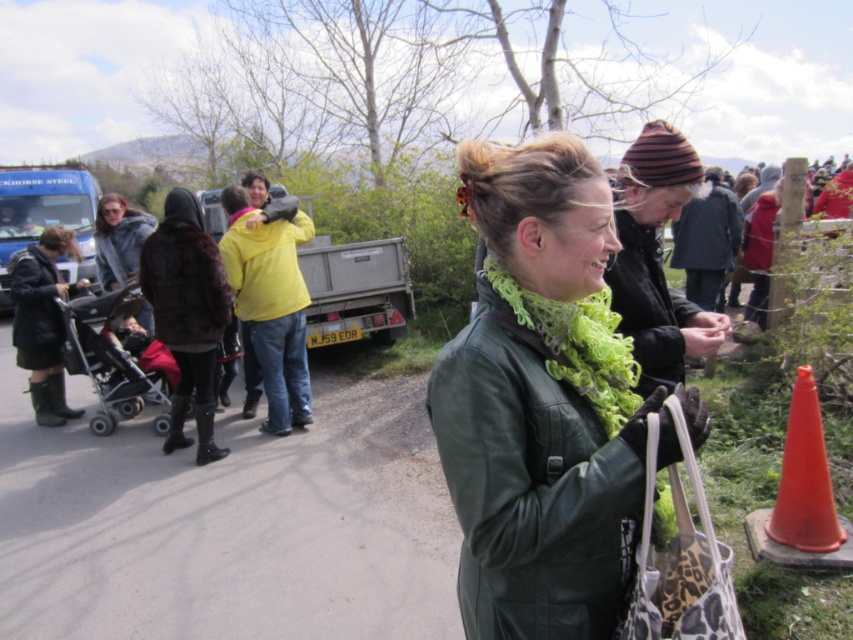
Question: Can you confirm if matte black boots at left is thinner than dark gray woolen jacket at upper right?

Choices:
 (A) no
 (B) yes

Answer: (B)

Question: Considering the real-world distances, which object is farthest from the fuzzy gray coat at left?

Choices:
 (A) green fuzzy scarf at center
 (B) velvet brown jacket at center
 (C) matte black boots at left

Answer: (A)

Question: Is matte black boots at left positioned at the back of fuzzy gray coat at left?

Choices:
 (A) yes
 (B) no

Answer: (B)

Question: Estimate the real-world distances between objects in this image. Which object is closer to the yellow matte jacket at center?

Choices:
 (A) green leather jacket at center
 (B) green fuzzy scarf at center
 (C) velvet brown jacket at center
 (D) matte black boots at left

Answer: (C)

Question: Which object is the closest to the green fuzzy scarf at center?

Choices:
 (A) matte black boots at left
 (B) yellow matte jacket at center
 (C) black plastic stroller at left

Answer: (B)

Question: Does matte black boots at left appear on the left side of yellow matte jacket at center?

Choices:
 (A) no
 (B) yes

Answer: (B)